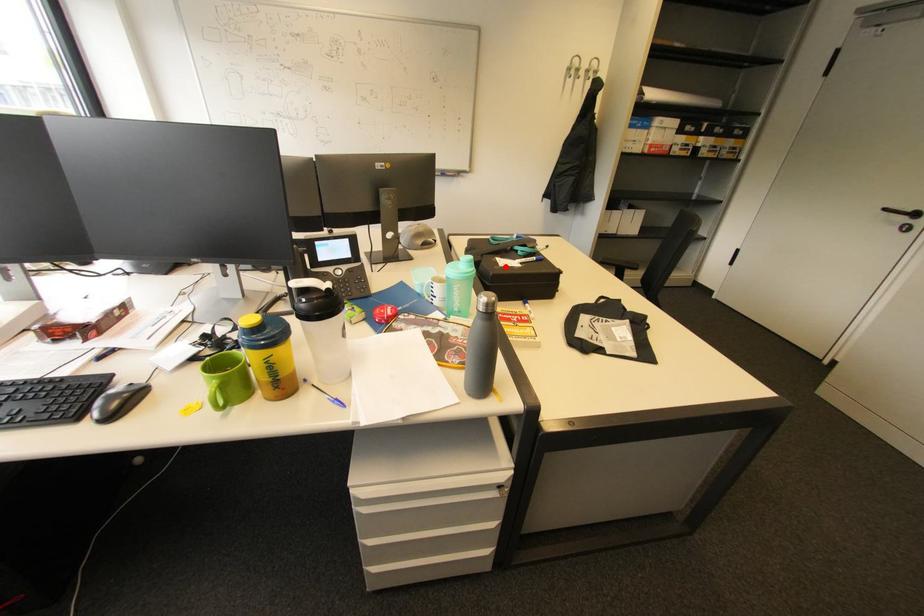
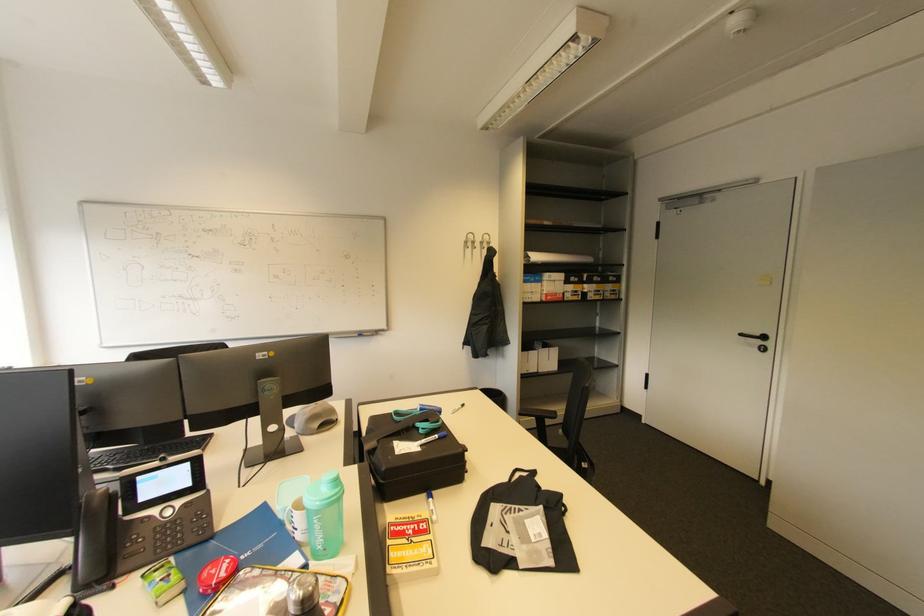
Find the pixel in the second image that matches the highlighted location in the first image.

(402, 455)